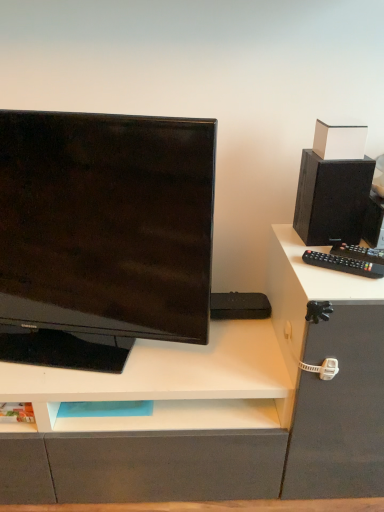
Question: Is point (329, 142) positioned closer to the camera than point (162, 258)?

Choices:
 (A) closer
 (B) farther

Answer: (B)

Question: From the image's perspective, is white matte box at upper right located above or below matte black monitor at left?

Choices:
 (A) above
 (B) below

Answer: (A)

Question: Estimate the real-world distances between objects in this image. Which object is farther from the black plastic remote control at right?

Choices:
 (A) matte black monitor at left
 (B) black matte speaker at upper right
 (C) white matte box at upper right

Answer: (A)

Question: Which object is positioned farthest from the black matte speaker at upper right?

Choices:
 (A) matte black monitor at left
 (B) white matte box at upper right
 (C) black plastic remote control at right

Answer: (A)